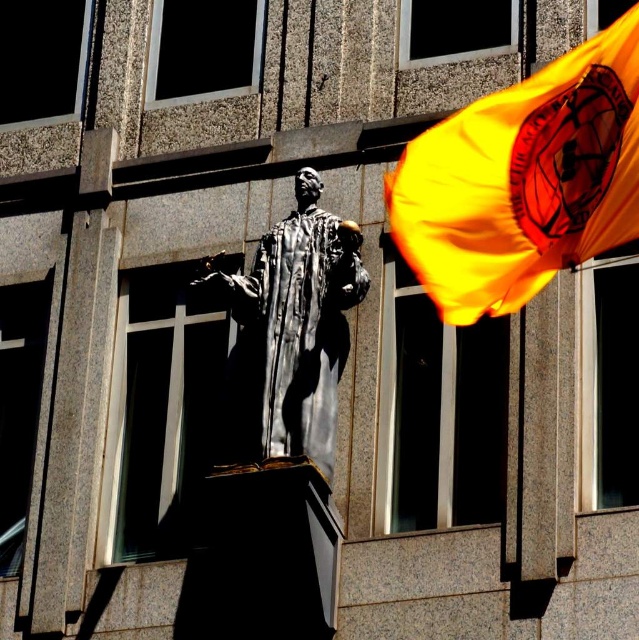
You are standing in front of the building and want to hang a new flag that is slightly smaller than the shiny orange flag at upper right. Where should you place it so that it is still visible from the street but not blocking the view of the polished silver statue at center?

You should place the new flag below the shiny orange flag at upper right, ensuring it remains visible from the street while staying below the polished silver statue at center to avoid blocking its view.

You are a visitor at the statue and want to take a photo that includes both the shiny orange flag at upper right and the polished silver statue at center. However, you notice that the flag is blocking part of the statue. Can you adjust your position to capture both without the flag overlapping the statue?

The shiny orange flag at upper right is in front of the polished silver statue at center, so moving to the side or changing your angle could allow you to capture both without the flag overlapping the statue.

You are standing at the base of the statue and want to locate the shiny orange flag at upper right. According to the coordinates provided, where should you look relative to the statue?

The shiny orange flag at upper right is located at coordinates 0.283 on the x axis and 0.820 on the y axis, so you should look to the upper right direction from the statue to find it.